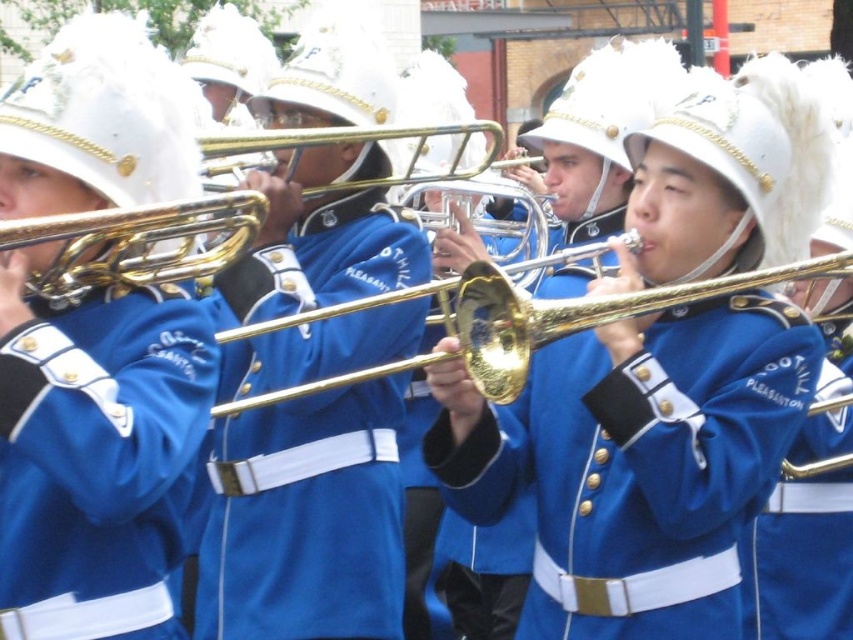
You are a photographer trying to capture the musician in the middle. Since the blue cotton jacket at center and gold brass trombone at center are both in the frame, which one should you focus on first to ensure the musician is centered?

The blue cotton jacket at center is to the right of the gold brass trombone at center, so focusing on the gold brass trombone at center first would help center the musician since the jacket is positioned to its right.

Based on the photo, you are a photographer trying to capture a clear shot of both the blue fabric uniform at center and the gold polished trombone at center. Since you want both objects in focus, which one should you adjust your camera focus on first?

The blue fabric uniform at center is closer to the viewer than the gold polished trombone at center. To ensure both are in focus, you should focus on the blue fabric uniform at center first, as it is the closer object.

You are a photographer trying to capture a clear shot of both the blue fabric uniform at center and the gold brass trombone at center. Which object should you adjust your camera focus to first if you want to ensure the closest one is in focus?

The blue fabric uniform at center is positioned on the left side of gold brass trombone at center, so you should focus on the blue fabric uniform at center first since it is closer to the camera.